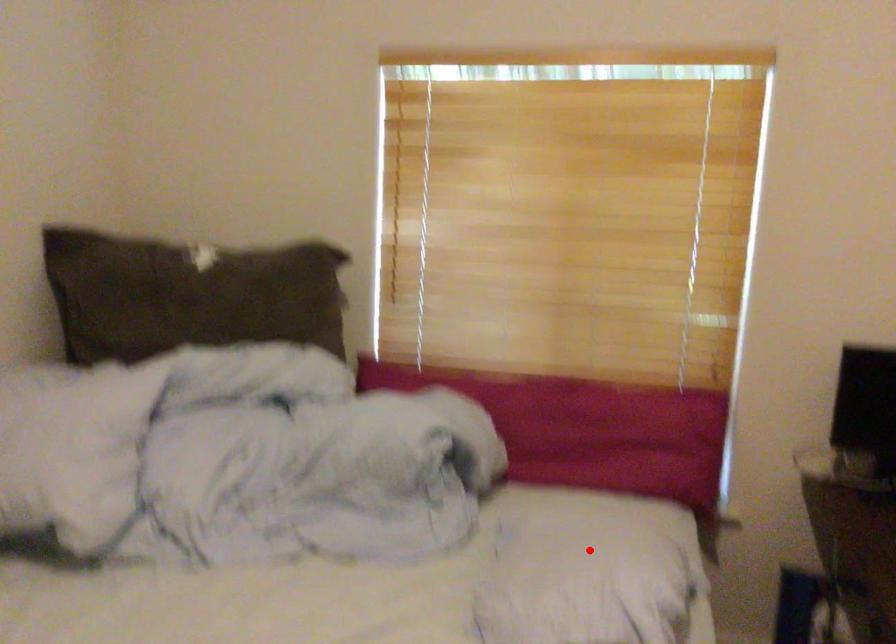
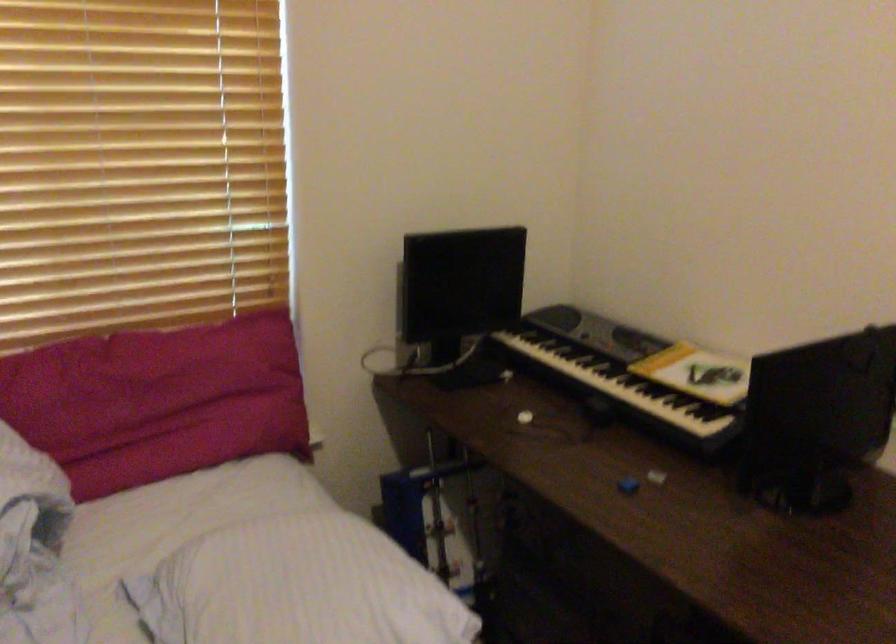
In the second image, find the point that corresponds to the highlighted location in the first image.

(303, 579)